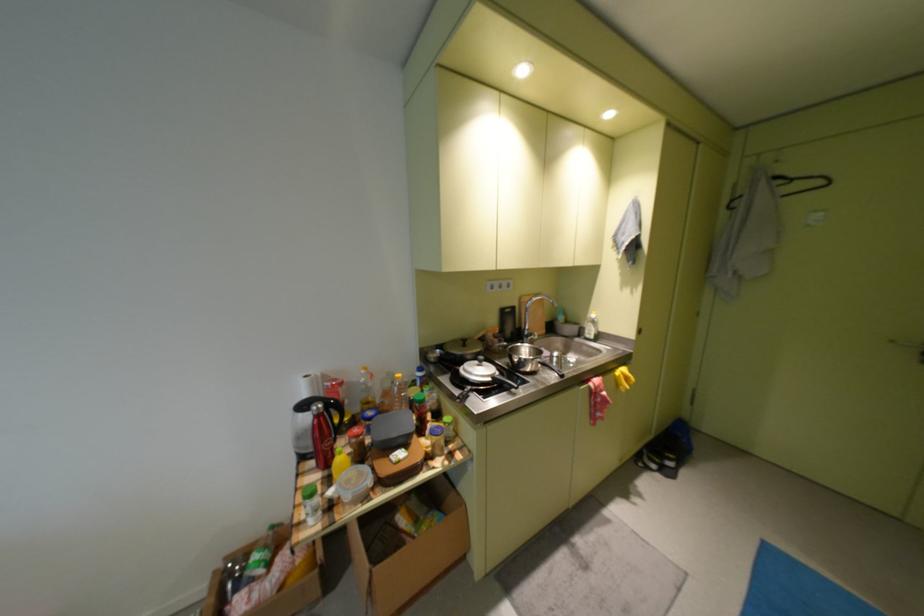
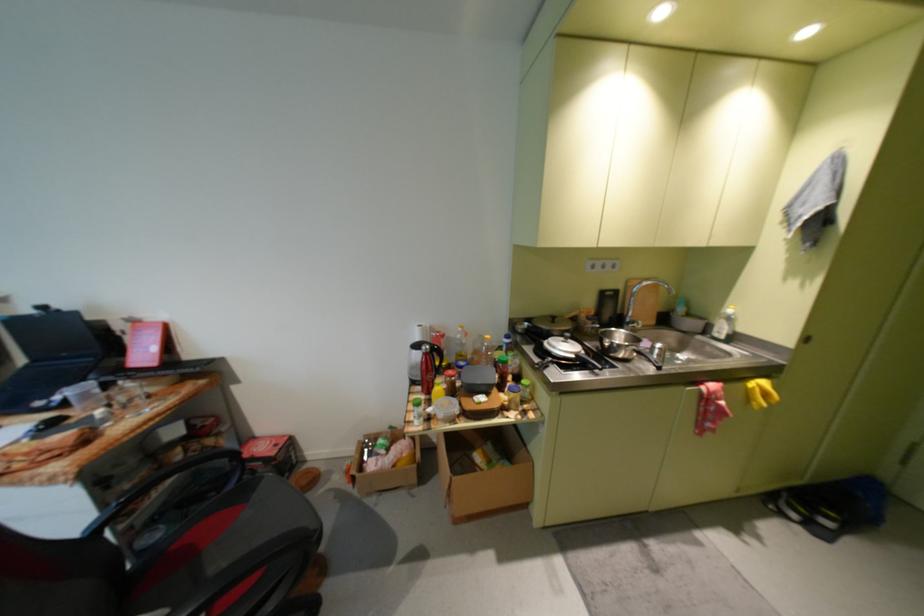
Where in the second image is the point corresponding to (503,379) from the first image?

(586, 357)